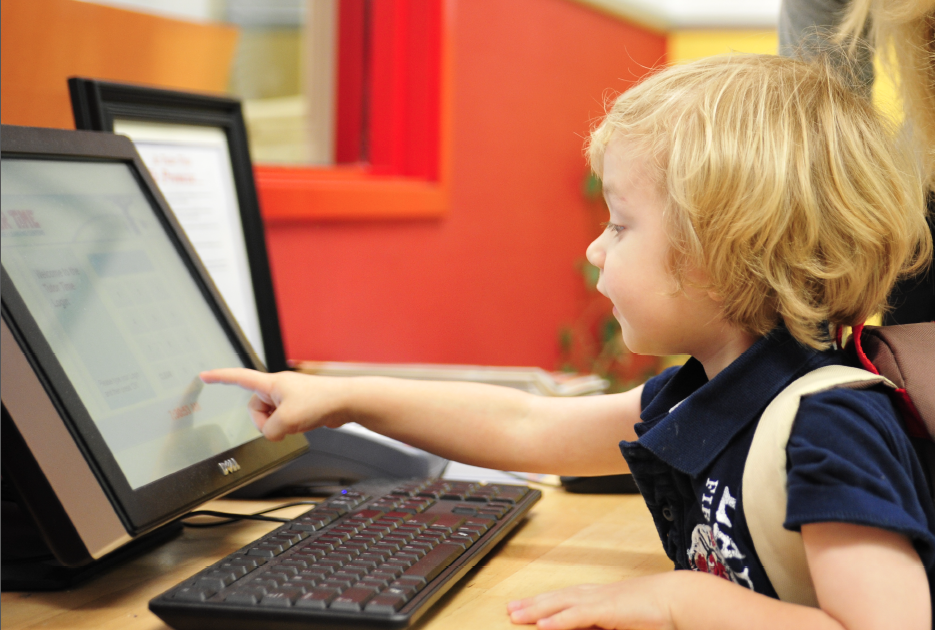
In order to click on 1 bookbag in this screenshot , I will do `click(907, 370)`.